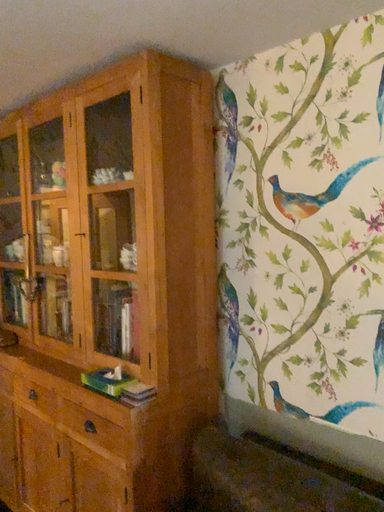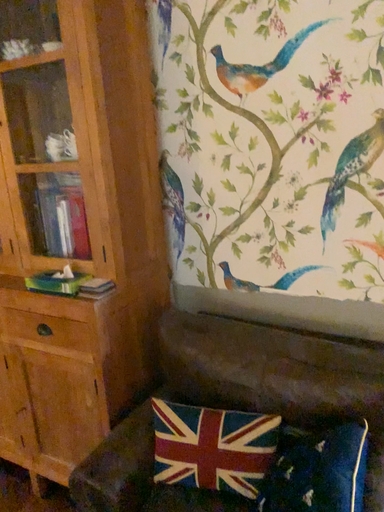
Question: Which way did the camera rotate in the video?

Choices:
 (A) rotated right
 (B) rotated left

Answer: (A)